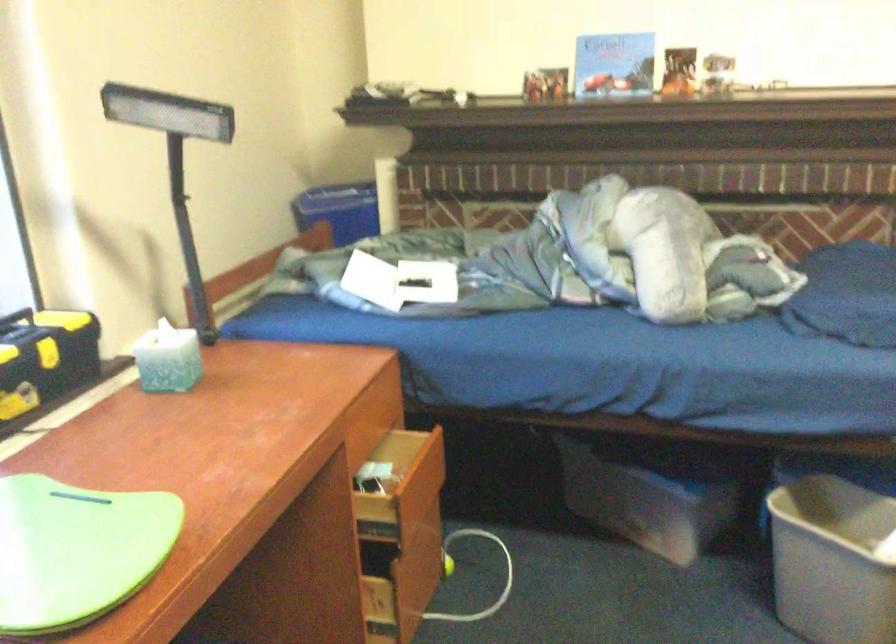
The width and height of the screenshot is (896, 644). In order to click on grey storage bin in this screenshot , I will do `click(832, 561)`.